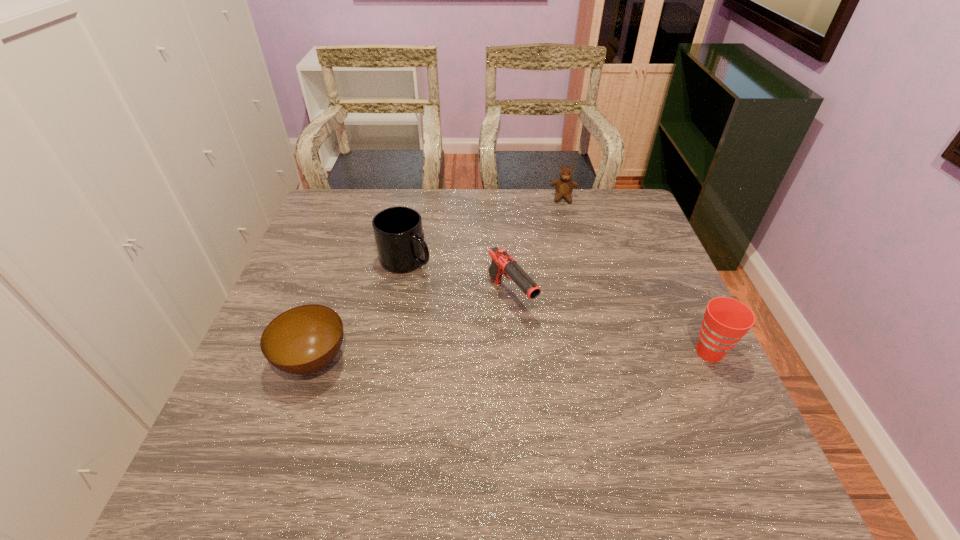
This screenshot has width=960, height=540. What are the coordinates of `free area in between the shortest object and the second object from left to right` in the screenshot? It's located at (360, 310).

Locate an element on the screen. Image resolution: width=960 pixels, height=540 pixels. free space between the bowl and the teddy bear is located at coordinates (439, 279).

Image resolution: width=960 pixels, height=540 pixels. I want to click on unoccupied position between the fourth object from right to left and the teddy bear, so click(485, 229).

At what (x,y) coordinates should I click in order to perform the action: click on vacant space that's between the rightmost object and the leftmost object. Please return your answer as a coordinate pair (x, y). This screenshot has height=540, width=960. Looking at the image, I should click on (511, 356).

The width and height of the screenshot is (960, 540). What are the coordinates of `vacant space that's between the shortest object and the rightmost object` in the screenshot? It's located at (511, 356).

Find the location of a particular element. free space between the mug and the farthest object is located at coordinates (485, 229).

Identify the location of object identified as the second closest to the gun. (303, 340).

Select which object appears as the closest to the third object from left to right. Please provide its 2D coordinates. Your answer should be formatted as a tuple, i.e. [(x, y)], where the tuple contains the x and y coordinates of a point satisfying the conditions above.

[(398, 231)]

Identify the location of free space that satisfies the following two spatial constraints: 1. on the front side of the rightmost object; 2. on the right side of the mug. This screenshot has width=960, height=540. (390, 352).

The image size is (960, 540). In order to click on free space that satisfies the following two spatial constraints: 1. on the back side of the leftmost object; 2. on the right side of the rightmost object in this screenshot , I will do `click(316, 352)`.